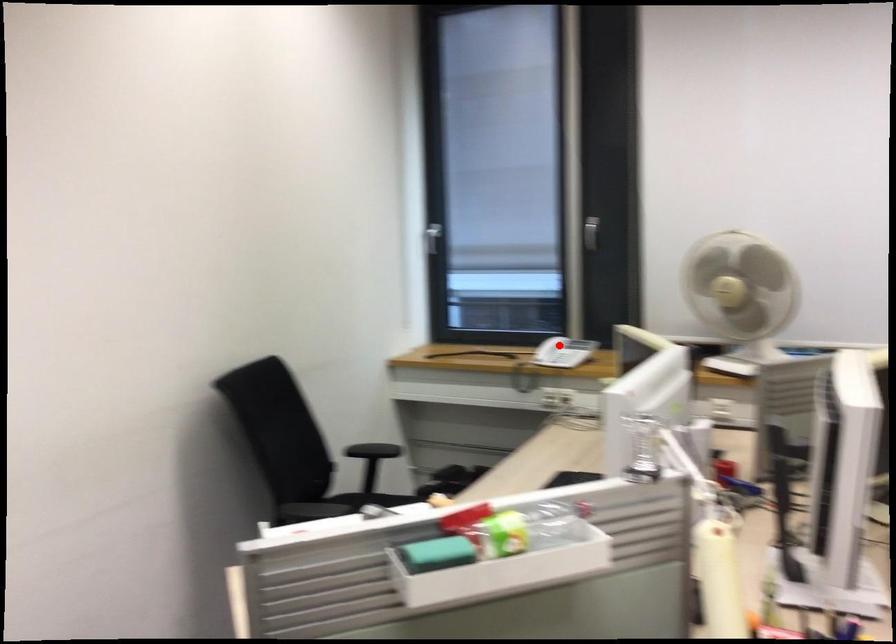
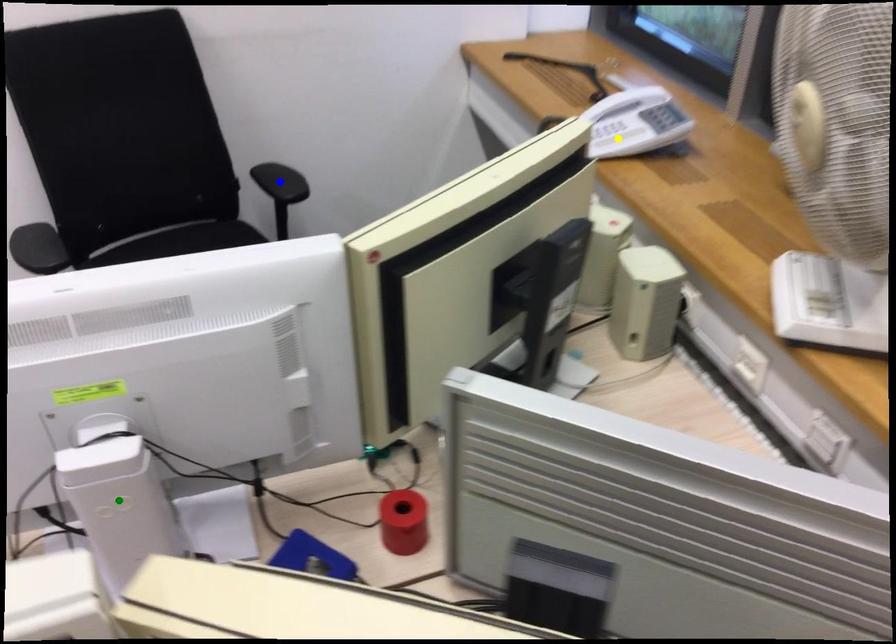
Question: I am providing you with two images of the same scene from different viewpoints. A red point is marked on the first image. You are given multiple points on the second image. Which spot in image 2 lines up with the point in image 1?

Choices:
 (A) blue point
 (B) yellow point
 (C) green point

Answer: (B)